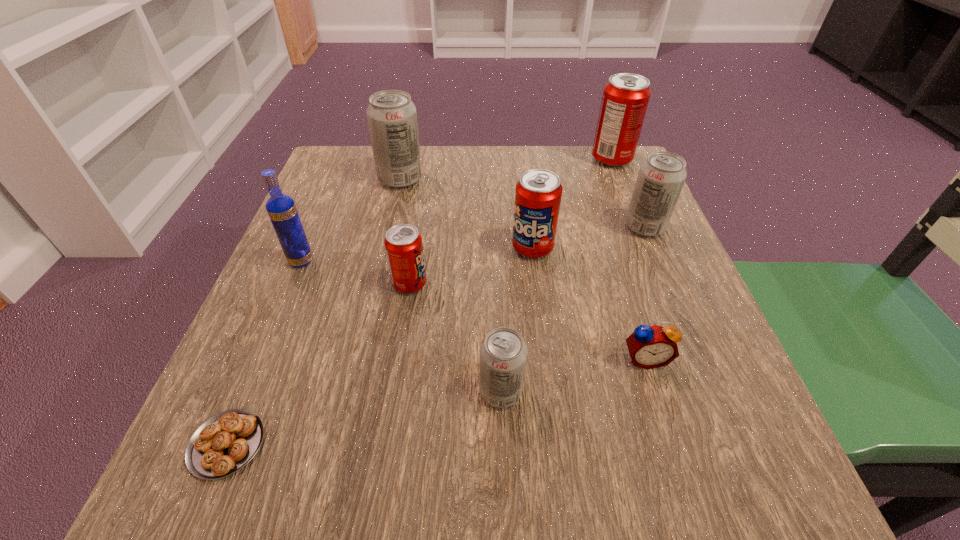
Find the location of a particular element. The height and width of the screenshot is (540, 960). object at the far left corner is located at coordinates (392, 117).

This screenshot has height=540, width=960. I want to click on object at the near left corner, so click(x=225, y=443).

Where is `object present at the far right corner`? This screenshot has width=960, height=540. object present at the far right corner is located at coordinates (625, 98).

Locate an element on the screen. This screenshot has width=960, height=540. vacant space at the far edge is located at coordinates (447, 188).

In the image, there is a desktop. What are the coordinates of `vacant space at the left edge` in the screenshot? It's located at (279, 317).

Locate an element on the screen. The width and height of the screenshot is (960, 540). free space at the right edge of the desktop is located at coordinates coord(620,233).

Find the location of `blank space at the far right corner`. blank space at the far right corner is located at coordinates pos(606,181).

At what (x,y) coordinates should I click in order to perform the action: click on unoccupied area between the rightmost red soda can and the biggest gray soda can. Please return your answer as a coordinate pair (x, y). Looking at the image, I should click on (506, 169).

This screenshot has width=960, height=540. Identify the location of free space between the shortest object and the sixth farthest object. (319, 364).

Image resolution: width=960 pixels, height=540 pixels. Identify the location of free point between the biggest gray soda can and the second biggest red soda can. (467, 213).